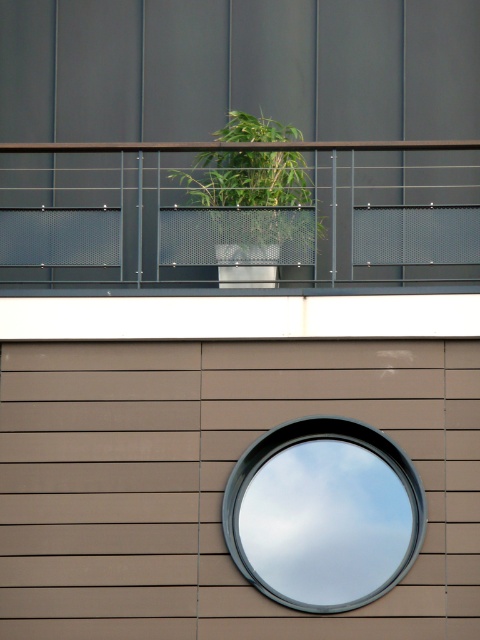
Question: Which object appears closest to the camera in this image?

Choices:
 (A) white plastic pot at upper center
 (B) smooth glass mirror at center

Answer: (A)

Question: Can you confirm if white plastic pot at upper center is positioned above green leafy plant at center?

Choices:
 (A) yes
 (B) no

Answer: (B)

Question: Among these points, which one is farthest from the camera?

Choices:
 (A) (297, 582)
 (B) (219, 144)

Answer: (B)

Question: Considering the real-world distances, which object is farthest from the smooth glass mirror at center?

Choices:
 (A) white plastic pot at upper center
 (B) green leafy plant at center

Answer: (B)

Question: Does white plastic pot at upper center have a lesser width compared to green leafy plant at center?

Choices:
 (A) yes
 (B) no

Answer: (B)

Question: Is white plastic pot at upper center further to camera compared to green leafy plant at center?

Choices:
 (A) yes
 (B) no

Answer: (B)